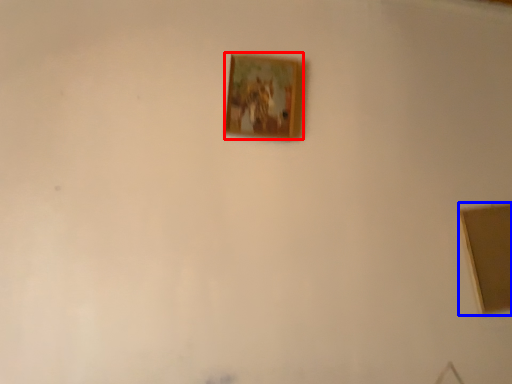
Question: Among these objects, which one is nearest to the camera, picture frame (highlighted by a red box) or picture frame (highlighted by a blue box)?

Choices:
 (A) picture frame
 (B) picture frame

Answer: (B)